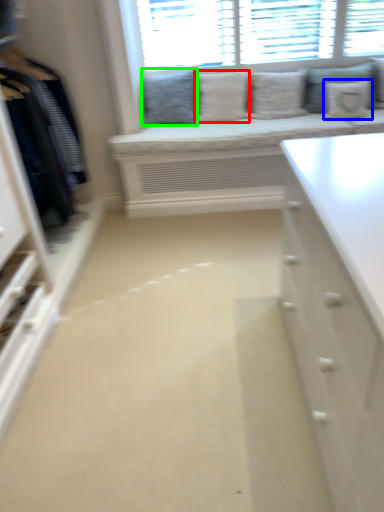
Question: Estimate the real-world distances between objects in this image. Which object is closer to pillow (highlighted by a red box), pillow (highlighted by a blue box) or pillow (highlighted by a green box)?

Choices:
 (A) pillow
 (B) pillow

Answer: (B)